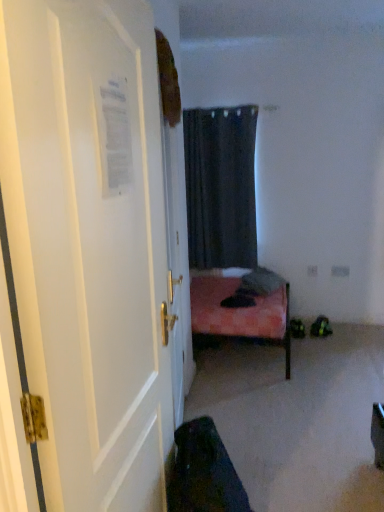
Question: Is dark matte curtain at center surrounded by white glossy door at left?

Choices:
 (A) yes
 (B) no

Answer: (B)

Question: Would you consider white glossy door at left to be distant from dark matte curtain at center?

Choices:
 (A) yes
 (B) no

Answer: (A)

Question: Is white glossy door at left next to dark matte curtain at center and touching it?

Choices:
 (A) no
 (B) yes

Answer: (A)

Question: Is white glossy door at left facing away from dark matte curtain at center?

Choices:
 (A) no
 (B) yes

Answer: (A)

Question: Does white glossy door at left have a greater width compared to dark matte curtain at center?

Choices:
 (A) yes
 (B) no

Answer: (B)

Question: From a real-world perspective, does white glossy door at left sit lower than dark matte curtain at center?

Choices:
 (A) no
 (B) yes

Answer: (B)

Question: Is dark matte curtain at center facing away from white glossy door at left?

Choices:
 (A) no
 (B) yes

Answer: (A)

Question: Is dark matte curtain at center taller than white glossy door at left?

Choices:
 (A) no
 (B) yes

Answer: (A)

Question: Is white glossy door at left completely or partially inside dark matte curtain at center?

Choices:
 (A) no
 (B) yes

Answer: (A)

Question: Considering the relative positions of dark matte curtain at center and white glossy door at left in the image provided, is dark matte curtain at center in front of white glossy door at left?

Choices:
 (A) no
 (B) yes

Answer: (A)

Question: From a real-world perspective, is dark matte curtain at center positioned over white glossy door at left based on gravity?

Choices:
 (A) yes
 (B) no

Answer: (A)

Question: Does dark matte curtain at center have a larger size compared to white glossy door at left?

Choices:
 (A) yes
 (B) no

Answer: (A)

Question: Is dark matte curtain at center spatially inside white glossy door at left, or outside of it?

Choices:
 (A) outside
 (B) inside

Answer: (A)